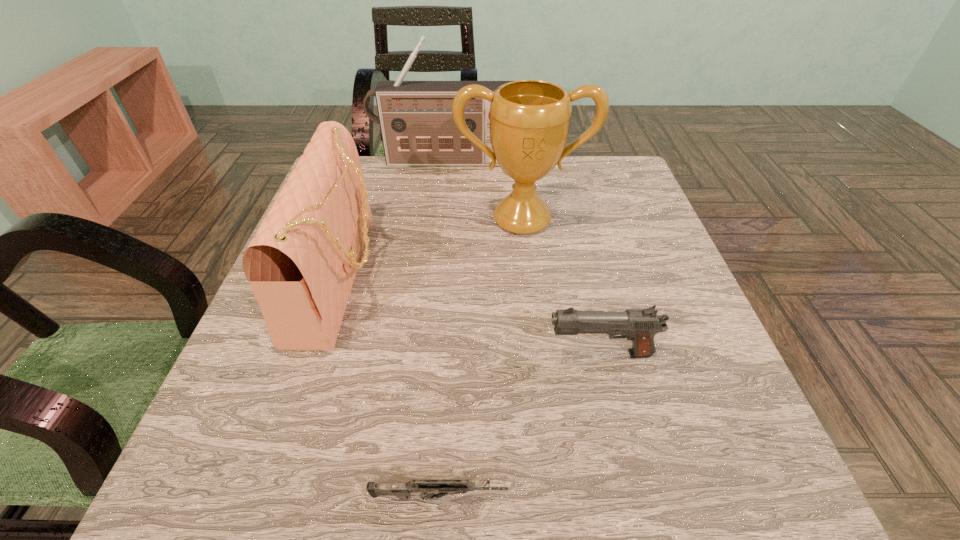
Where is `object identified as the third closest to the farthest object`? This screenshot has height=540, width=960. object identified as the third closest to the farthest object is located at coordinates (x=640, y=325).

Locate an element on the screen. free location that satisfies the following two spatial constraints: 1. on the front panel of the radio receiver; 2. on the front-facing side of the third shortest object is located at coordinates (430, 275).